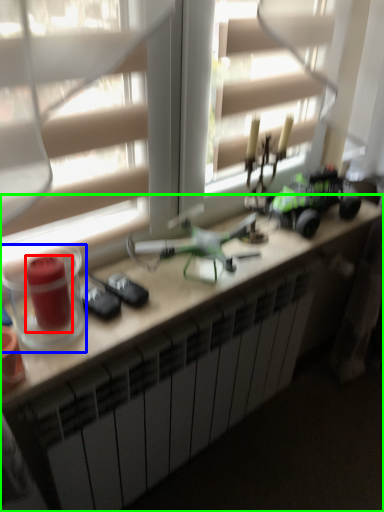
Question: Which object is positioned closest to candle holder (highlighted by a red box)? Select from candle holder (highlighted by a blue box) and desk (highlighted by a green box).

Choices:
 (A) candle holder
 (B) desk

Answer: (A)